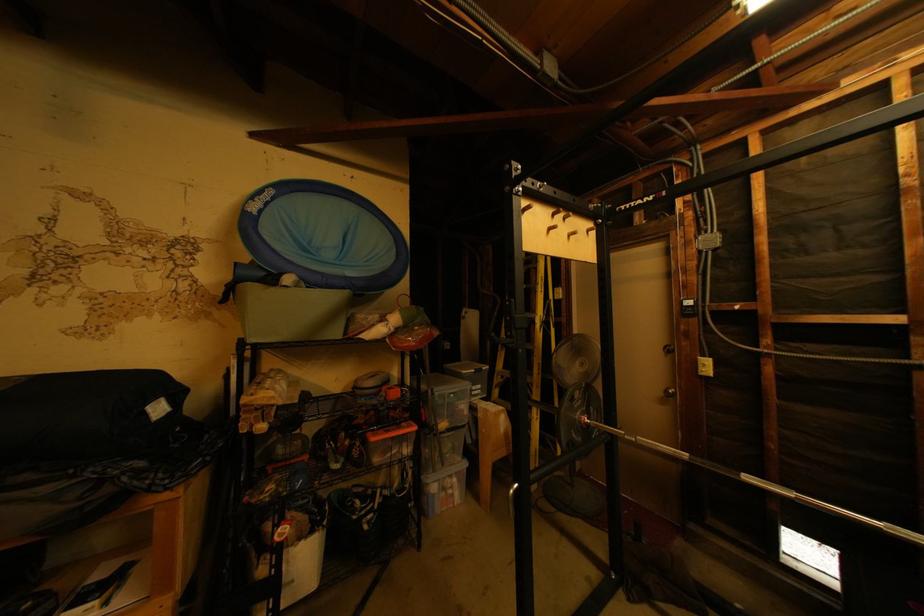
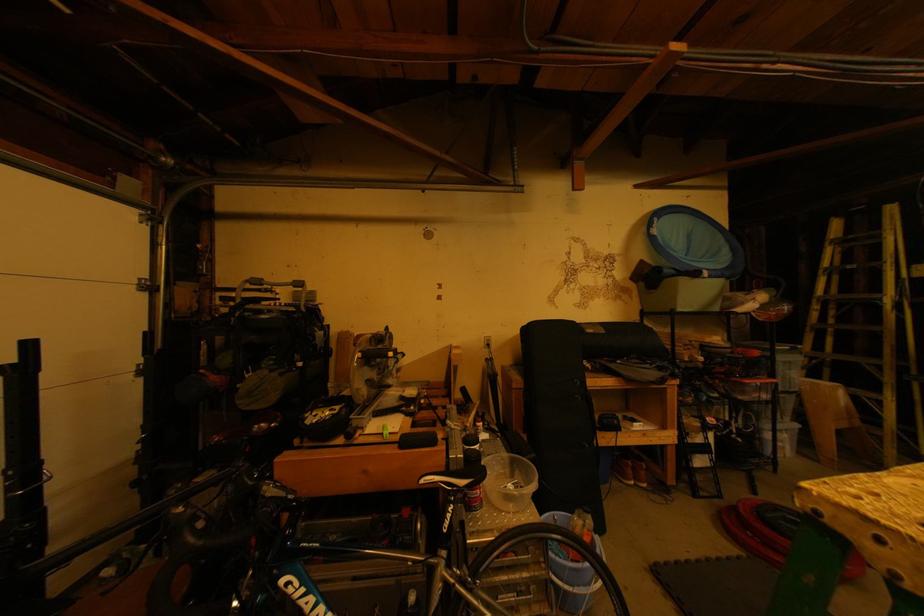
The images are taken continuously from a first-person perspective. In which direction are you moving?

The cameraman walked toward left, backward.